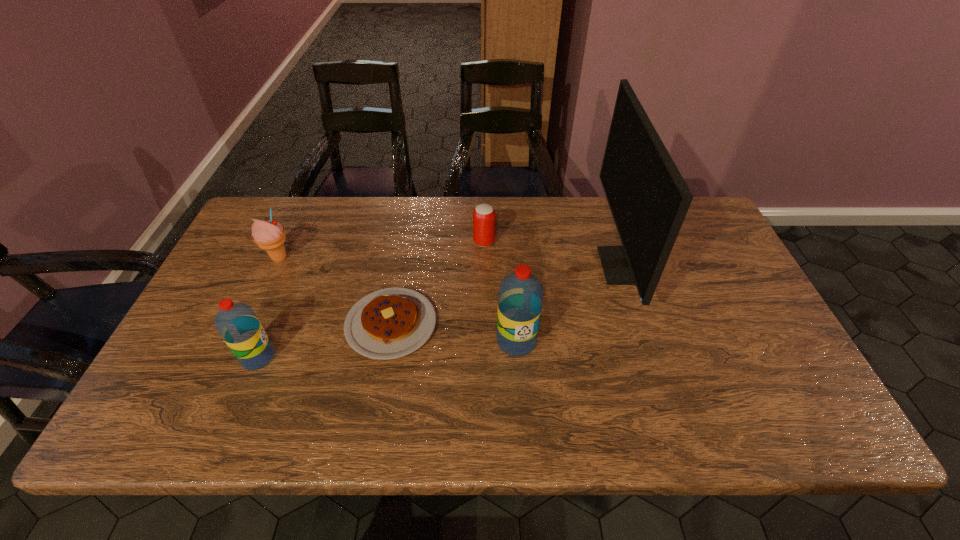
I want to click on object at the near edge, so click(238, 325).

The height and width of the screenshot is (540, 960). Find the location of `object that is at the left edge`. object that is at the left edge is located at coordinates (270, 235).

The width and height of the screenshot is (960, 540). In order to click on free location at the far edge in this screenshot , I will do `click(609, 239)`.

Where is `vacant space at the near edge`? vacant space at the near edge is located at coordinates (368, 366).

At what (x,y) coordinates should I click in order to perform the action: click on vacant space at the left edge of the desktop. Please return your answer as a coordinate pair (x, y). Looking at the image, I should click on (234, 259).

Where is `vacant region at the right edge of the desktop`? Image resolution: width=960 pixels, height=540 pixels. vacant region at the right edge of the desktop is located at coordinates (750, 352).

Image resolution: width=960 pixels, height=540 pixels. In order to click on vacant space at the far left corner in this screenshot , I will do `click(252, 217)`.

Identify the location of vacant space at the near left corner of the desktop. (193, 367).

You are a GUI agent. You are given a task and a screenshot of the screen. Output one action in this format:
    pyautogui.click(x=<x>, y=<y>)
    Task: Click on the vacant space that is in between the rightmost object and the fourth shortest object
    
    Given the screenshot: What is the action you would take?
    pyautogui.click(x=441, y=312)

The height and width of the screenshot is (540, 960). In order to click on unoccupied position between the pancake and the shorter water bottle in this screenshot , I will do tap(324, 341).